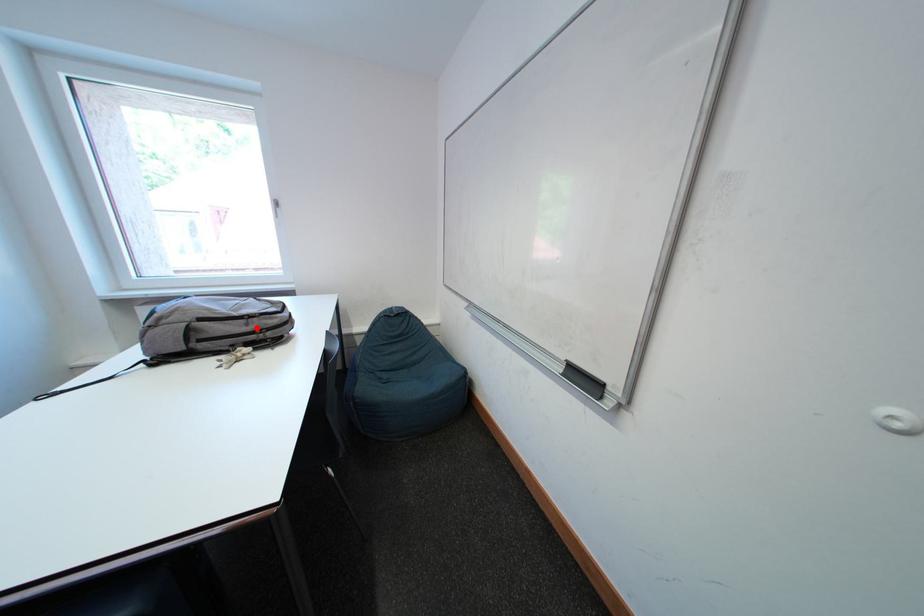
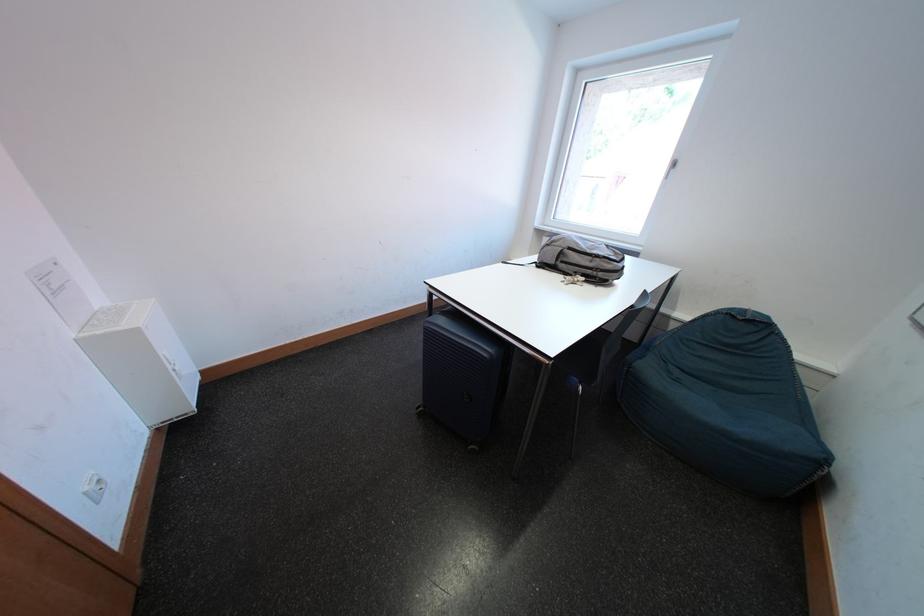
Where in the second image is the point corresponding to the highlighted location from the first image?

(601, 265)